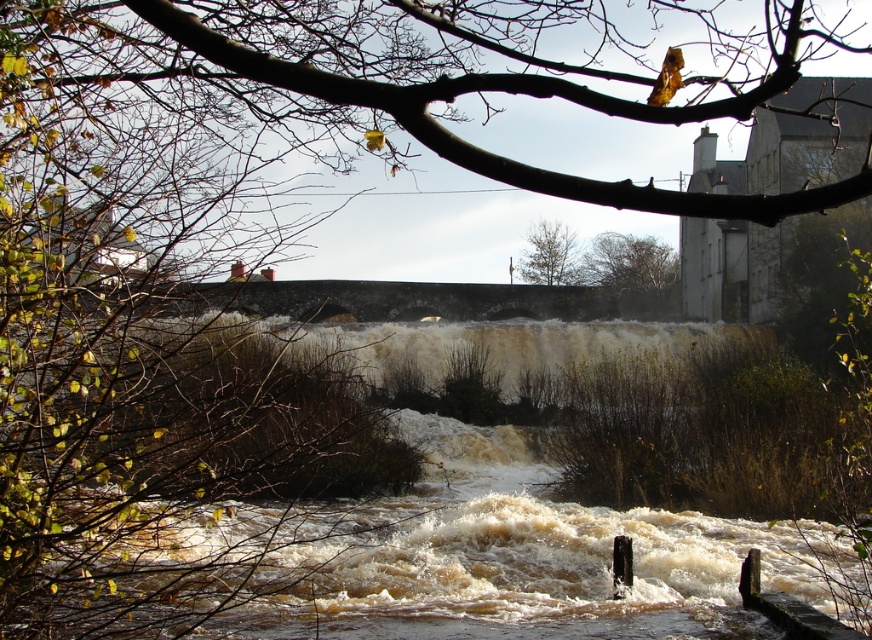
Question: Does brown leafy tree at upper center have a greater width compared to green leafy tree at upper center?

Choices:
 (A) no
 (B) yes

Answer: (B)

Question: Among these points, which one is nearest to the camera?

Choices:
 (A) (569, 273)
 (B) (637, 282)

Answer: (B)

Question: Can you confirm if brown leafy tree at upper center is smaller than green leafy tree at upper center?

Choices:
 (A) no
 (B) yes

Answer: (A)

Question: Is brown leafy tree at upper center further to camera compared to green leafy tree at upper center?

Choices:
 (A) no
 (B) yes

Answer: (A)